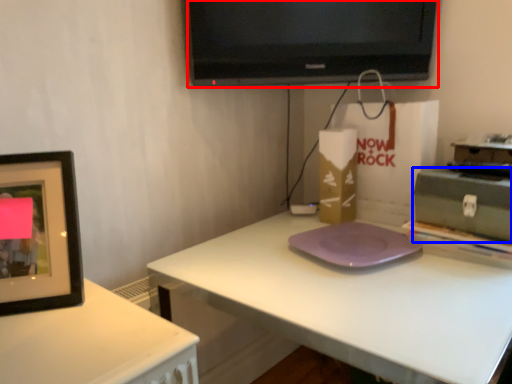
Question: Among these objects, which one is nearest to the camera, television (highlighted by a red box) or box (highlighted by a blue box)?

Choices:
 (A) television
 (B) box

Answer: (B)